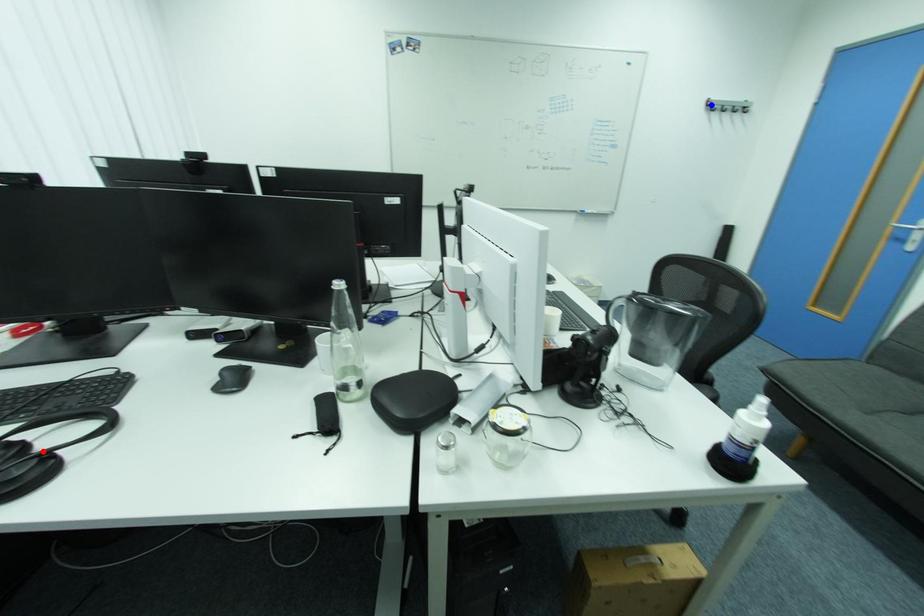
Question: In the image, two points are highlighted. Which point is nearer to the camera? Reply with the corresponding letter.

Choices:
 (A) blue point
 (B) red point

Answer: (B)